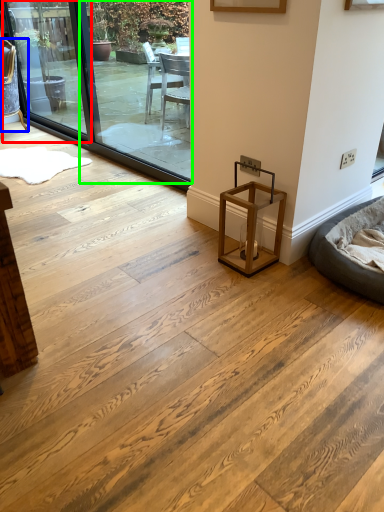
Question: Which object is positioned closest to window screen (highlighted by a red box)? Select from chair (highlighted by a blue box) and window screen (highlighted by a green box).

Choices:
 (A) chair
 (B) window screen

Answer: (A)